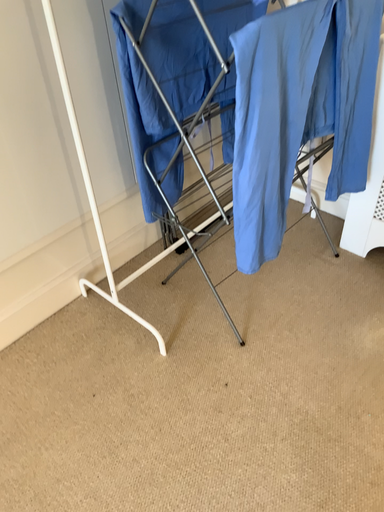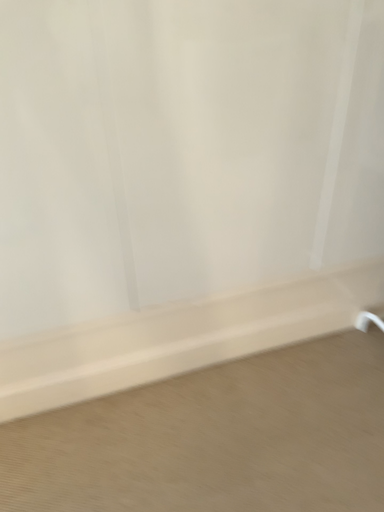
Question: How did the camera likely rotate when shooting the video?

Choices:
 (A) rotated upward
 (B) rotated downward

Answer: (A)